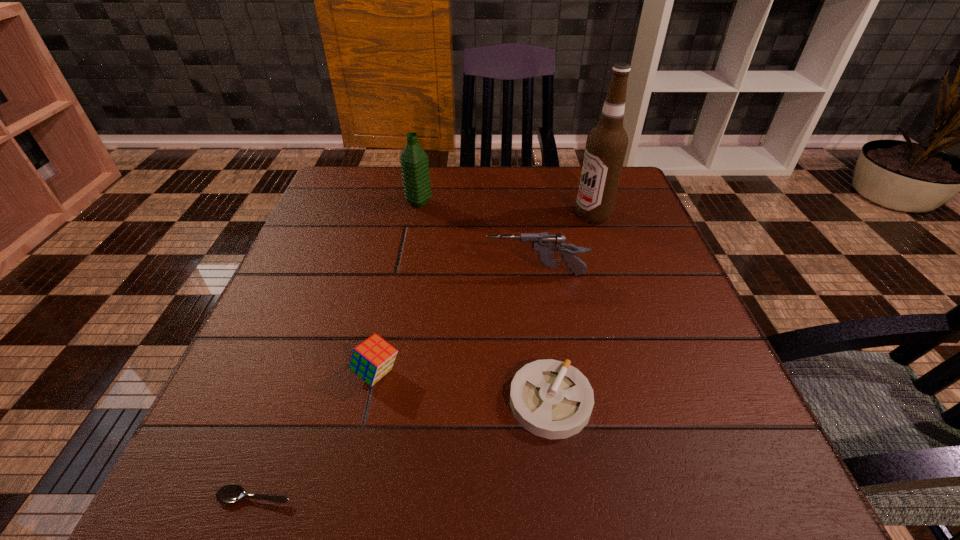
Locate an element on the screen. water bottle that is at the far edge is located at coordinates pos(414,161).

Identify the location of object that is at the near edge. [x=229, y=494].

This screenshot has width=960, height=540. Identify the location of object at the left edge. (229, 494).

Identify the location of object present at the right edge. (606, 145).

In order to click on object that is at the near left corner in this screenshot , I will do `click(229, 494)`.

The image size is (960, 540). Find the location of `object located at the far right corner`. object located at the far right corner is located at coordinates (606, 145).

At what (x,y) coordinates should I click in order to perform the action: click on blank space at the far edge. Please return your answer as a coordinate pair (x, y). This screenshot has height=540, width=960. Looking at the image, I should click on (397, 188).

Identify the location of free space at the near edge of the desktop. The image size is (960, 540). (425, 481).

What are the coordinates of `vacant space at the left edge of the desktop` in the screenshot? It's located at (332, 222).

Where is `vacant space at the right edge of the desktop`? vacant space at the right edge of the desktop is located at coordinates (630, 272).